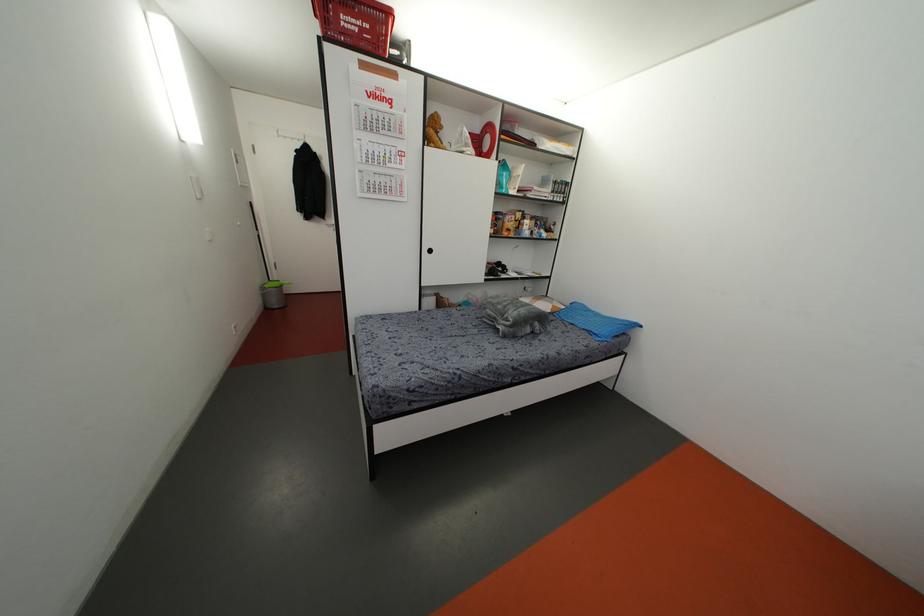
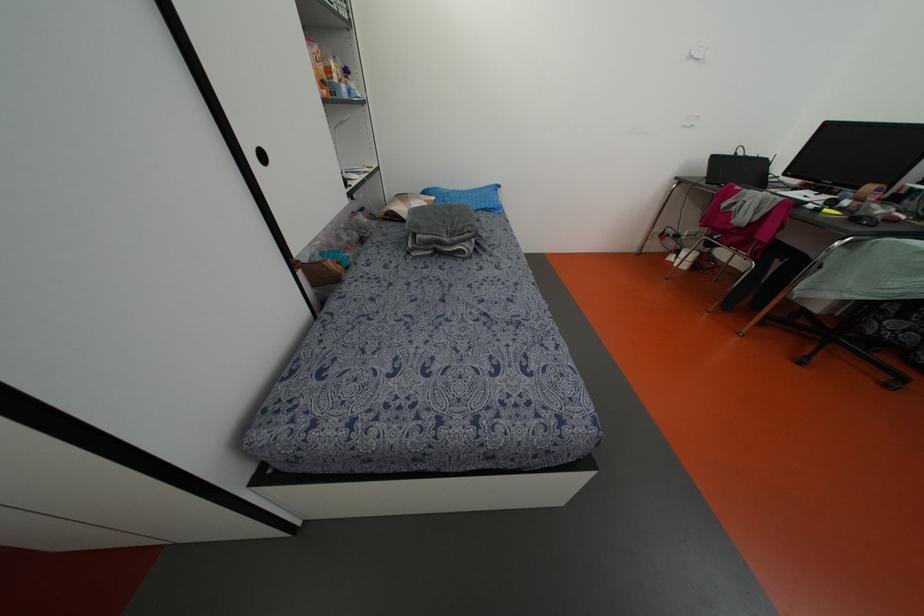
Locate, in the second image, the point that corresponds to point (430, 251) in the first image.

(262, 156)